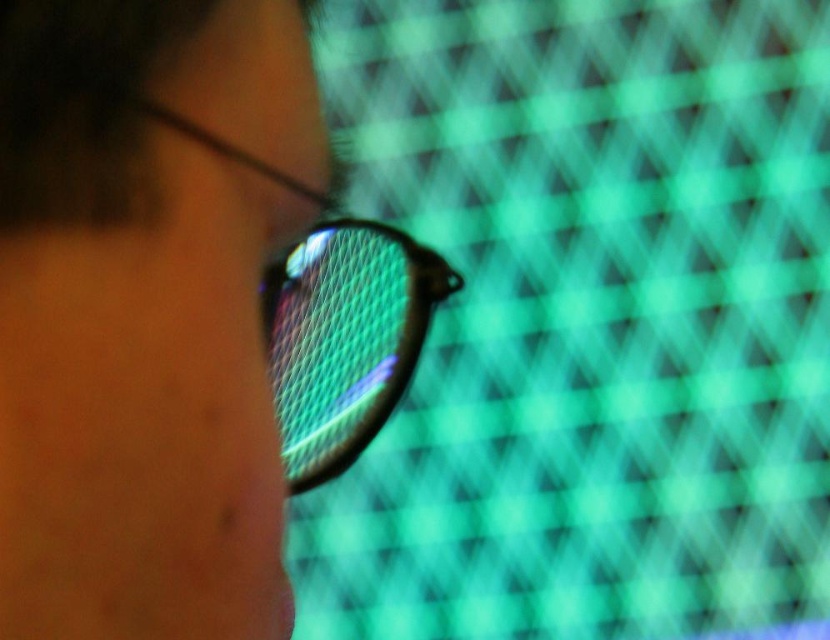
Question: Is mesh-patterned racket at center positioned behind matte black glasses at center?

Choices:
 (A) yes
 (B) no

Answer: (A)

Question: Is mesh-patterned racket at center smaller than matte black glasses at center?

Choices:
 (A) no
 (B) yes

Answer: (A)

Question: From the image, what is the correct spatial relationship of mesh-patterned racket at center in relation to matte black glasses at center?

Choices:
 (A) above
 (B) below

Answer: (B)

Question: Which of the following is the closest to the observer?

Choices:
 (A) mesh-patterned racket at center
 (B) matte black glasses at center

Answer: (B)